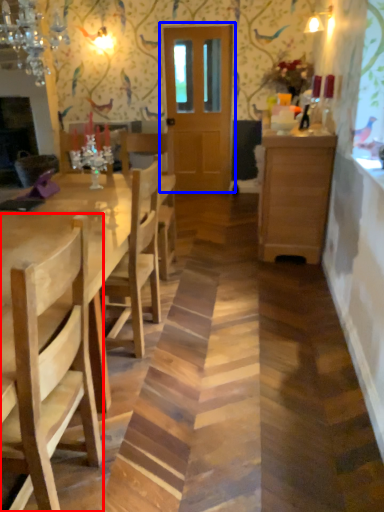
Question: Among these objects, which one is farthest to the camera, chair (highlighted by a red box) or door (highlighted by a blue box)?

Choices:
 (A) chair
 (B) door

Answer: (B)